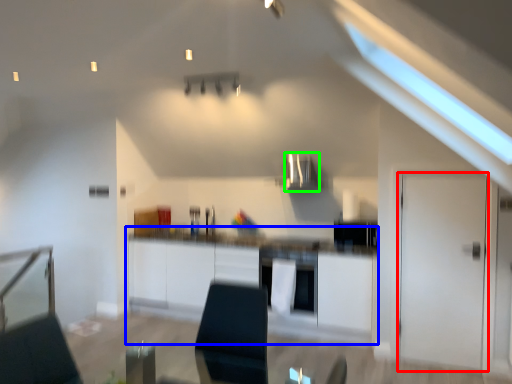
Question: Which is nearer to the door (highlighted by a red box)? cabinetry (highlighted by a blue box) or exhaust hood (highlighted by a green box).

Choices:
 (A) cabinetry
 (B) exhaust hood

Answer: (A)